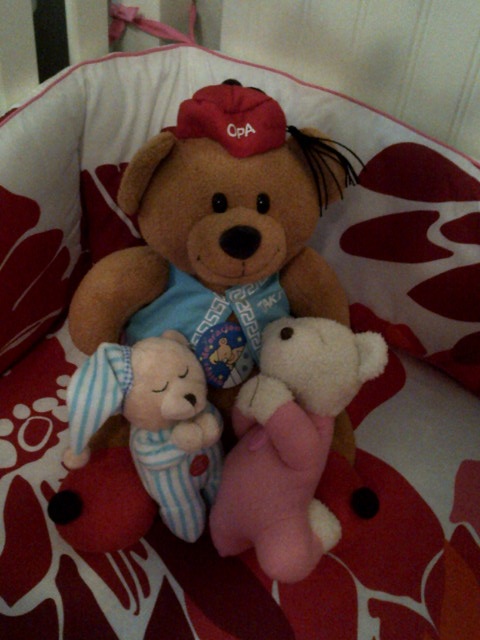
The height and width of the screenshot is (640, 480). I want to click on beige teddy bear, so click(x=152, y=371).